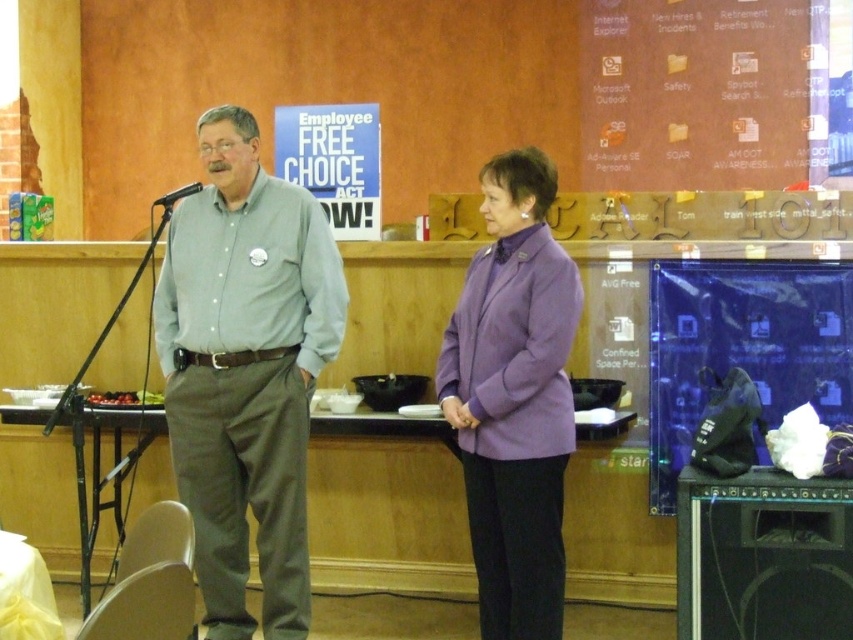
Between purple fabric jacket at center and shiny red grapes at lower left, which one appears on the left side from the viewer's perspective?

From the viewer's perspective, shiny red grapes at lower left appears more on the left side.

Describe the element at coordinates (514, 397) in the screenshot. I see `purple fabric jacket at center` at that location.

Does point (480, 579) lie behind point (141, 397)?

No.

The width and height of the screenshot is (853, 640). Identify the location of purple fabric jacket at center. (514, 397).

Does purple fabric jacket at center appear on the right side of black metallic microphone at left?

Correct, you'll find purple fabric jacket at center to the right of black metallic microphone at left.

Between point (494, 556) and point (177, 195), which one is positioned behind?

Positioned behind is point (177, 195).

Between point (497, 348) and point (198, 188), which one is positioned behind?

The point (198, 188) is more distant.

Where is `purple fabric jacket at center`? purple fabric jacket at center is located at coordinates (514, 397).

The image size is (853, 640). What do you see at coordinates (245, 371) in the screenshot?
I see `gray cotton shirt at center` at bounding box center [245, 371].

Is gray cotton shirt at center to the right of black metallic microphone at left from the viewer's perspective?

Indeed, gray cotton shirt at center is positioned on the right side of black metallic microphone at left.

Between point (288, 440) and point (160, 198), which one is positioned in front?

Point (288, 440)

I want to click on gray cotton shirt at center, so click(245, 371).